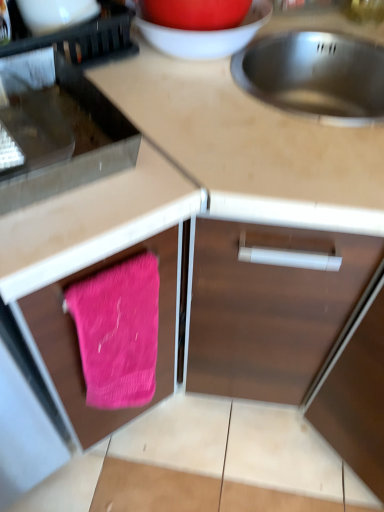
Question: Looking at their shapes, would you say metallic stainless steel sink at upper right is wider or thinner than matte white bowl at upper center?

Choices:
 (A) thin
 (B) wide

Answer: (B)

Question: Would you say metallic stainless steel sink at upper right is to the left or to the right of matte white bowl at upper center in the picture?

Choices:
 (A) right
 (B) left

Answer: (A)

Question: Considering the real-world distances, which object is closest to the pink fabric at lower left?

Choices:
 (A) pink knitted towel at lower left
 (B) metallic stainless steel oven at left, arranged as the 2th appliance when viewed from the left
 (C) black plastic dish rack at upper left, which is counted as the 1th appliance, starting from the left
 (D) matte white bowl at upper center
 (E) metallic stainless steel sink at upper right

Answer: (A)

Question: Estimate the real-world distances between objects in this image. Which object is farther from the metallic stainless steel sink at upper right?

Choices:
 (A) wooden cabinet door at lower right, the third appliance positioned from the top
 (B) metallic stainless steel oven at left, arranged as the 2th appliance when viewed from the left
 (C) black plastic dish rack at upper left, marked as the third appliance in a right-to-left arrangement
 (D) pink knitted towel at lower left
 (E) pink fabric at lower left

Answer: (A)